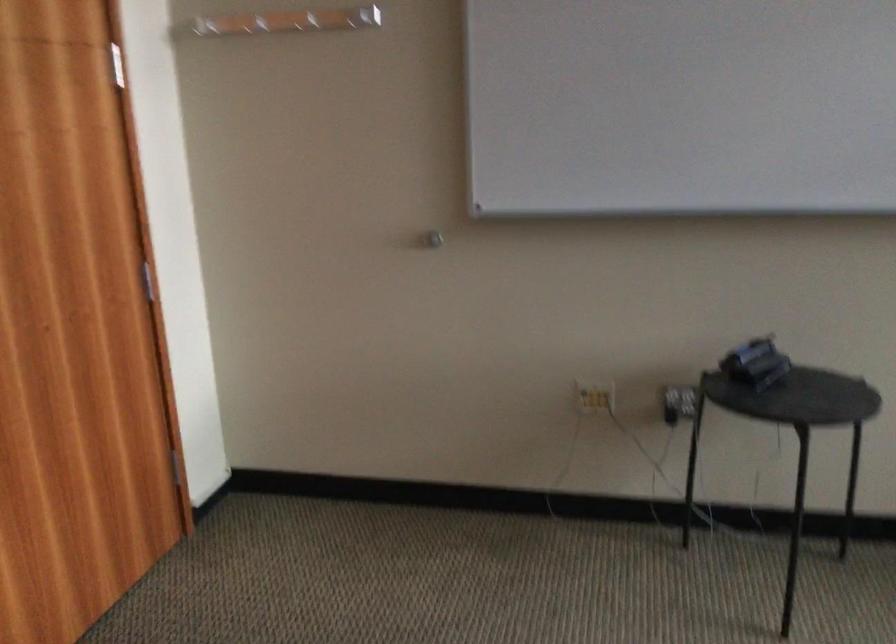
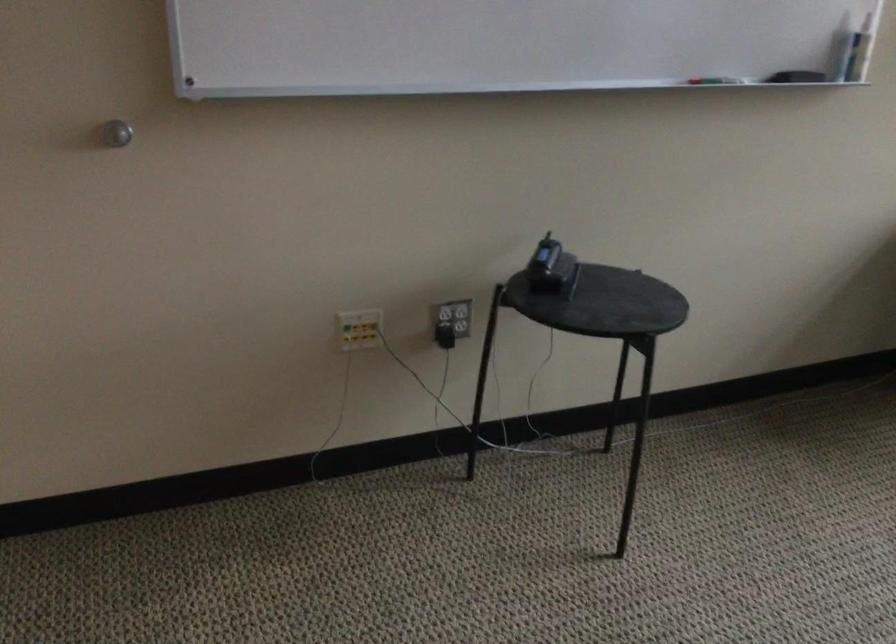
Find the pixel in the second image that matches [739,354] in the first image.

(550, 268)